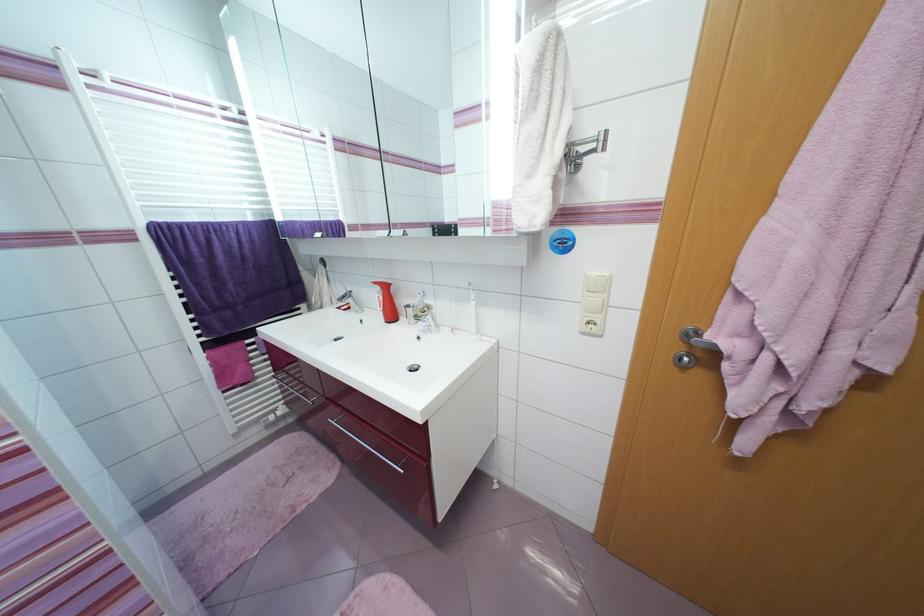
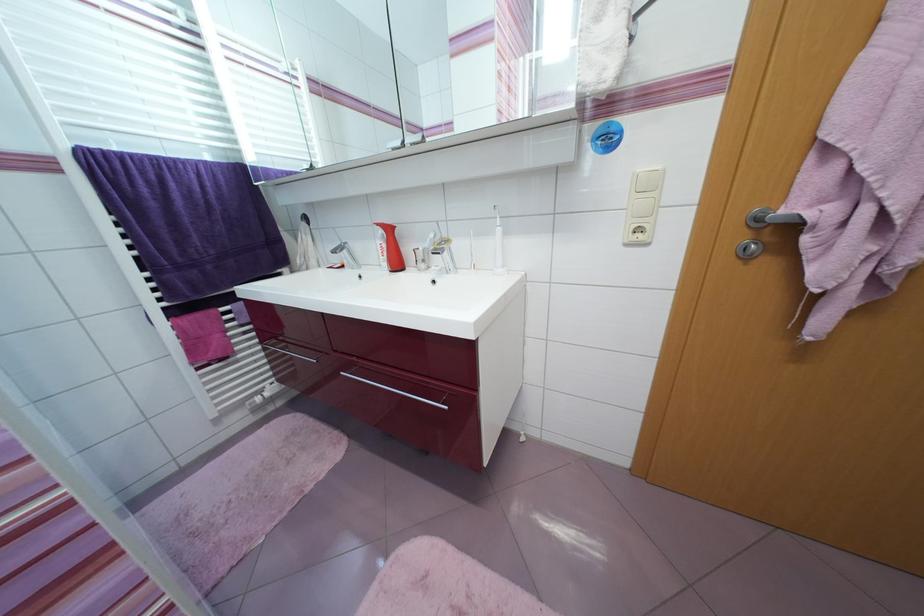
Find the pixel in the second image that matches point 391,288 in the first image.

(394, 231)